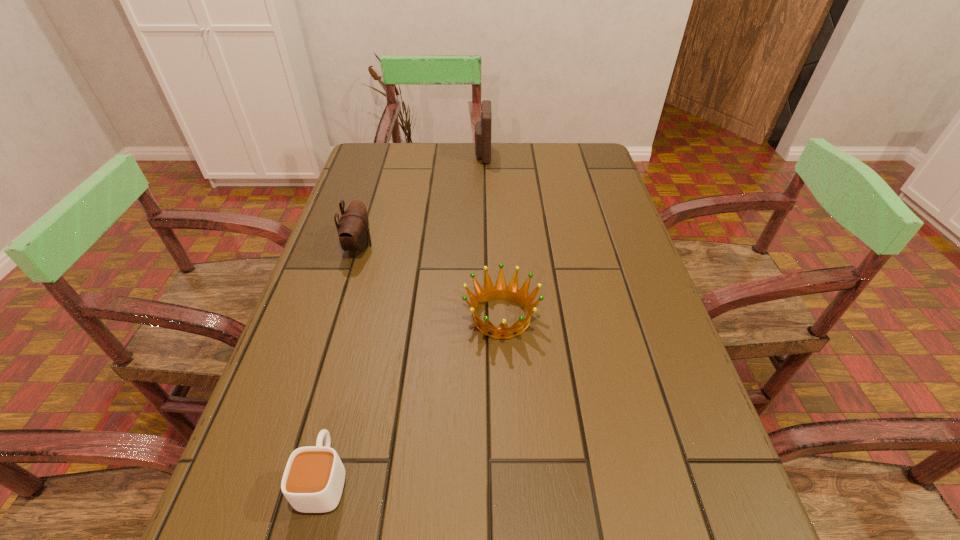
Locate an element on the screen. Image resolution: width=960 pixels, height=540 pixels. the farther pouch is located at coordinates (482, 136).

Where is `the tallest object`? The image size is (960, 540). the tallest object is located at coordinates [x=482, y=136].

Locate an element on the screen. the left pouch is located at coordinates (353, 229).

This screenshot has width=960, height=540. I want to click on the shorter pouch, so click(x=353, y=229).

Identify the location of crown. The image size is (960, 540). [501, 291].

Image resolution: width=960 pixels, height=540 pixels. Find the location of `cup`. cup is located at coordinates (313, 480).

Locate an element on the screen. vacant space situated 0.350m with an open flap on the farther pouch is located at coordinates (368, 155).

Where is `vacant space situated 0.350m with an open flap on the farther pouch`? The image size is (960, 540). vacant space situated 0.350m with an open flap on the farther pouch is located at coordinates (368, 155).

Find the location of a particular element. free space located with an open flap on the farther pouch is located at coordinates (456, 155).

At what (x,y) coordinates should I click in order to perform the action: click on free space located with the flap open on the left pouch. Please return your answer as a coordinate pair (x, y). The width and height of the screenshot is (960, 540). Looking at the image, I should click on (428, 246).